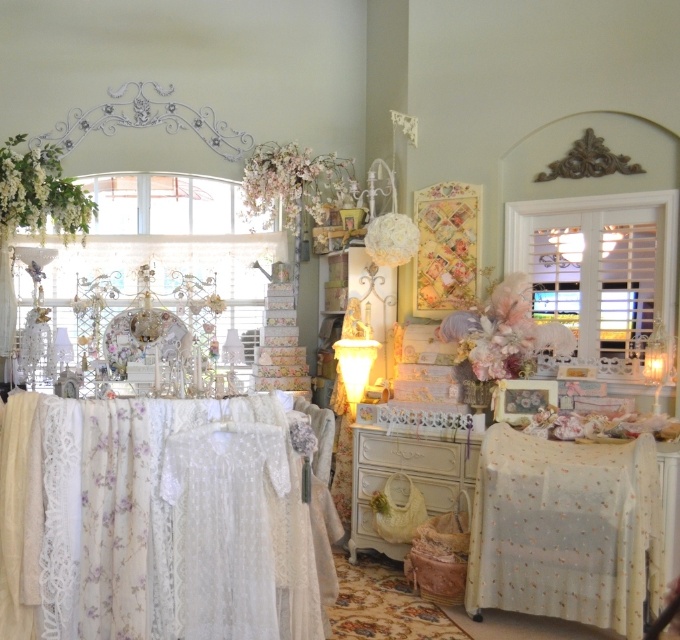
Find the location of `white lace tablecloth at lower left`. white lace tablecloth at lower left is located at coordinates (158, 520).

Is point (80, 538) farther from viewer compared to point (503, 545)?

No, it is not.

Find the location of a particular element. white lace tablecloth at lower left is located at coordinates (158, 520).